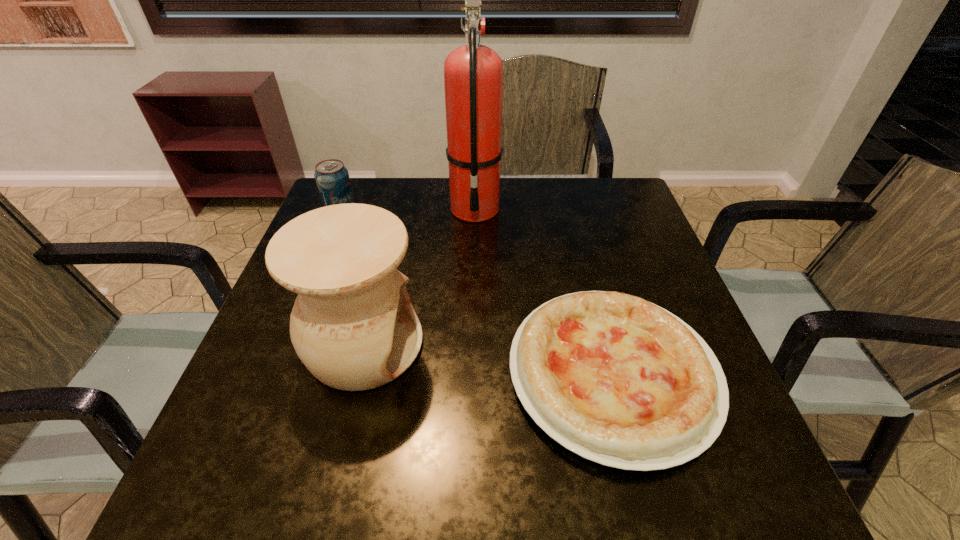
Where is `blank space at the far right corner of the desktop`? The width and height of the screenshot is (960, 540). blank space at the far right corner of the desktop is located at coordinates (603, 208).

Where is `unoccupied area between the tallest object and the third tallest object`? The height and width of the screenshot is (540, 960). unoccupied area between the tallest object and the third tallest object is located at coordinates (408, 211).

Identify the location of free spot between the pottery and the shortest object. (488, 359).

The width and height of the screenshot is (960, 540). What are the coordinates of `free spot between the fire extinguisher and the pizza` in the screenshot? It's located at (543, 291).

This screenshot has width=960, height=540. I want to click on free point between the pottery and the pizza, so click(x=488, y=359).

Identify the location of vacant region between the pizza and the tallest object. The height and width of the screenshot is (540, 960). tap(543, 291).

Where is `unoccupied position between the shortest object and the pottery`? This screenshot has height=540, width=960. unoccupied position between the shortest object and the pottery is located at coordinates (488, 359).

The height and width of the screenshot is (540, 960). I want to click on vacant space in between the pottery and the fire extinguisher, so click(x=420, y=276).

Locate an element on the screen. free space between the pottery and the tallest object is located at coordinates (420, 276).

Choose which object is the second nearest neighbor to the second shortest object. Please provide its 2D coordinates. Your answer should be formatted as a tuple, i.e. [(x, y)], where the tuple contains the x and y coordinates of a point satisfying the conditions above.

[(353, 326)]